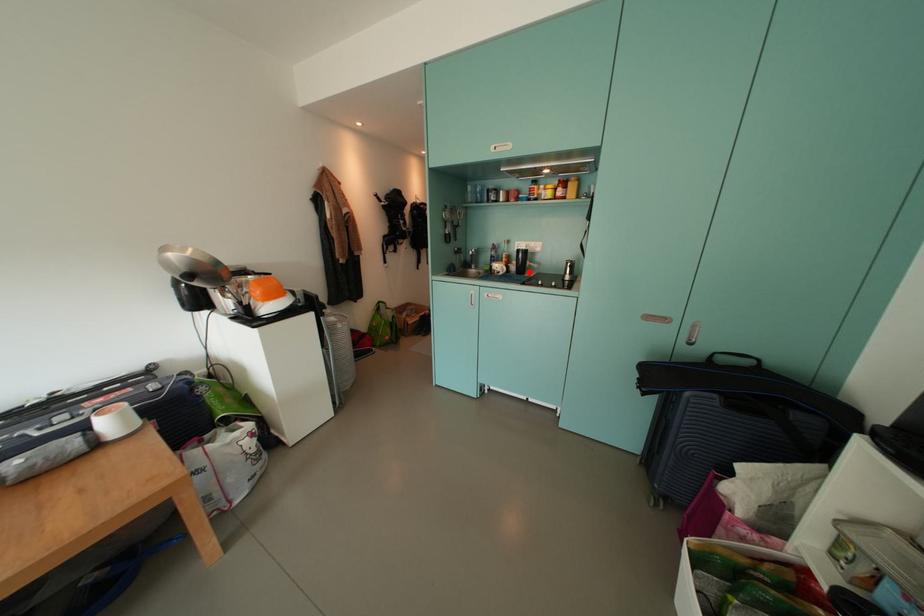
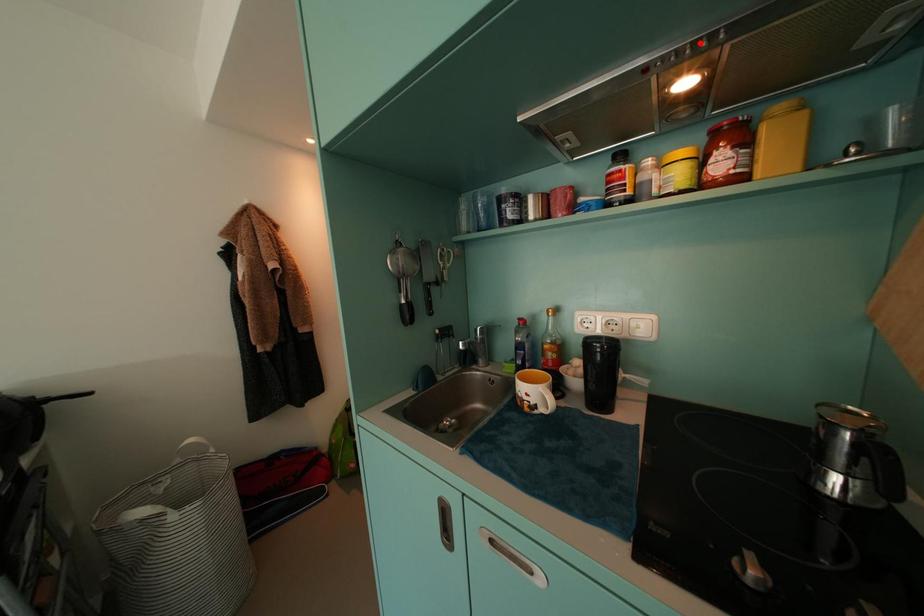
I am providing you with two images of the same scene from different viewpoints. A red point is marked on the first image and another point is marked on the second image. Does the point marked in image1 correspond to the same location as the one in image2?

No